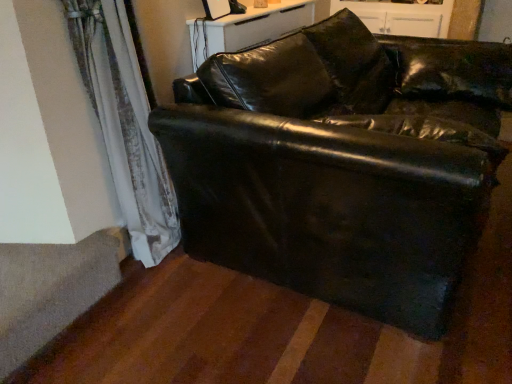
Identify the location of white glossy dresser at upper center. (401, 17).

What do you see at coordinates (401, 17) in the screenshot? I see `white glossy dresser at upper center` at bounding box center [401, 17].

The height and width of the screenshot is (384, 512). What do you see at coordinates (341, 164) in the screenshot? I see `black leather couch at center` at bounding box center [341, 164].

Find the location of a particular element. Image resolution: width=512 pixels, height=384 pixels. satin white curtain at lower left is located at coordinates (125, 124).

In the image, is gray carpet at lower left positioned in front of or behind white glossy dresser at upper center?

gray carpet at lower left is positioned closer to the viewer than white glossy dresser at upper center.

Can you tell me how much gray carpet at lower left and white glossy dresser at upper center differ in facing direction?

gray carpet at lower left and white glossy dresser at upper center are facing 88.9 degrees away from each other.

Looking at their sizes, would you say gray carpet at lower left is wider or thinner than white glossy dresser at upper center?

Considering their sizes, gray carpet at lower left looks slimmer than white glossy dresser at upper center.

From the image's perspective, is gray carpet at lower left on top of white glossy dresser at upper center?

Incorrect, from the image's perspective, gray carpet at lower left is lower than white glossy dresser at upper center.

Is gray carpet at lower left at the back of white glossy dresser at upper center?

white glossy dresser at upper center is not turned away from gray carpet at lower left.

Considering the relative sizes of white glossy dresser at upper center and gray carpet at lower left in the image provided, is white glossy dresser at upper center wider than gray carpet at lower left?

Correct, the width of white glossy dresser at upper center exceeds that of gray carpet at lower left.

Is white glossy dresser at upper center not near gray carpet at lower left?

Absolutely, white glossy dresser at upper center is distant from gray carpet at lower left.

Is gray carpet at lower left located within white glossy dresser at upper center?

No, gray carpet at lower left is not inside white glossy dresser at upper center.

In the scene shown: Does black leather couch at center lie behind white glossy dresser at upper center?

No, black leather couch at center is in front of white glossy dresser at upper center.

Does black leather couch at center have a smaller size compared to white glossy dresser at upper center?

No.

Find the location of a particular element. This screenshot has width=512, height=384. studio couch in front of the white glossy dresser at upper center is located at coordinates (341, 164).

Considering the relative sizes of black leather couch at center and white glossy dresser at upper center in the image provided, is black leather couch at center shorter than white glossy dresser at upper center?

No, black leather couch at center is not shorter than white glossy dresser at upper center.

Is black leather couch at center in contact with satin white curtain at lower left?

No, black leather couch at center is not next to satin white curtain at lower left.

Is black leather couch at center situated inside satin white curtain at lower left or outside?

black leather couch at center lies outside satin white curtain at lower left.

Is black leather couch at center positioned with its back to satin white curtain at lower left?

Yes, satin white curtain at lower left is at the back of black leather couch at center.

Is black leather couch at center in front of satin white curtain at lower left?

Yes.

Can you tell me how much white glossy dresser at upper center and satin white curtain at lower left differ in facing direction?

They differ by 88.9 degrees in their facing directions.

Is white glossy dresser at upper center facing away from satin white curtain at lower left?

No, satin white curtain at lower left is not at the back of white glossy dresser at upper center.

Is white glossy dresser at upper center to the left of satin white curtain at lower left from the viewer's perspective?

No.

Measure the distance between satin white curtain at lower left and black leather couch at center.

satin white curtain at lower left and black leather couch at center are 25.79 inches apart from each other.

Who is taller, satin white curtain at lower left or black leather couch at center?

satin white curtain at lower left.

From a real-world perspective, is satin white curtain at lower left located beneath black leather couch at center?

No, from a real-world perspective, satin white curtain at lower left is not under black leather couch at center.

In terms of size, does satin white curtain at lower left appear bigger or smaller than black leather couch at center?

Clearly, satin white curtain at lower left is smaller in size than black leather couch at center.

Do you think satin white curtain at lower left is within white glossy dresser at upper center, or outside of it?

satin white curtain at lower left lies outside white glossy dresser at upper center.

Considering the sizes of objects satin white curtain at lower left and white glossy dresser at upper center in the image provided, who is shorter, satin white curtain at lower left or white glossy dresser at upper center?

white glossy dresser at upper center.

From a real-world perspective, is satin white curtain at lower left physically located above or below white glossy dresser at upper center?

satin white curtain at lower left is below white glossy dresser at upper center.

From the image's perspective, is satin white curtain at lower left positioned above or below white glossy dresser at upper center?

satin white curtain at lower left is situated lower than white glossy dresser at upper center in the image.

Find the location of a particular element. The height and width of the screenshot is (384, 512). stairwell below the white glossy dresser at upper center (from the image's perspective) is located at coordinates (52, 289).

You are a GUI agent. You are given a task and a screenshot of the screen. Output one action in this format:
    pyautogui.click(x=<x>, y=<y>)
    Task: Click on the stairwell that appears below the white glossy dresser at upper center (from a real-world perspective)
    
    Given the screenshot: What is the action you would take?
    pyautogui.click(x=52, y=289)

From the image, which object appears to be nearer to black leather couch at center, satin white curtain at lower left or white glossy dresser at upper center?

satin white curtain at lower left is closer to black leather couch at center.

Which object lies nearer to the anchor point white glossy dresser at upper center, gray carpet at lower left or satin white curtain at lower left?

The object closer to white glossy dresser at upper center is satin white curtain at lower left.

Which object lies further to the anchor point gray carpet at lower left, white glossy dresser at upper center or satin white curtain at lower left?

The object further to gray carpet at lower left is white glossy dresser at upper center.

From the image, which object appears to be farther from gray carpet at lower left, white glossy dresser at upper center or black leather couch at center?

white glossy dresser at upper center lies further to gray carpet at lower left than the other object.

Considering their positions, is satin white curtain at lower left positioned further to gray carpet at lower left than white glossy dresser at upper center?

Based on the image, white glossy dresser at upper center appears to be further to gray carpet at lower left.

Based on their spatial positions, is white glossy dresser at upper center or black leather couch at center closer to satin white curtain at lower left?

black leather couch at center is closer to satin white curtain at lower left.

Based on their spatial positions, is satin white curtain at lower left or gray carpet at lower left further from black leather couch at center?

gray carpet at lower left lies further to black leather couch at center than the other object.

From the image, which object appears to be nearer to gray carpet at lower left, satin white curtain at lower left or black leather couch at center?

satin white curtain at lower left is positioned closer to the anchor gray carpet at lower left.

The image size is (512, 384). Identify the location of curtain located between black leather couch at center and white glossy dresser at upper center in the depth direction. (125, 124).

You are a GUI agent. You are given a task and a screenshot of the screen. Output one action in this format:
    pyautogui.click(x=<x>, y=<y>)
    Task: Click on the curtain between gray carpet at lower left and black leather couch at center from left to right
    The image size is (512, 384).
    Given the screenshot: What is the action you would take?
    pos(125,124)

Where is `stairwell between satin white curtain at lower left and white glossy dresser at upper center along the z-axis`? This screenshot has width=512, height=384. stairwell between satin white curtain at lower left and white glossy dresser at upper center along the z-axis is located at coordinates (52, 289).

Find the location of a particular element. This screenshot has height=384, width=512. stairwell between black leather couch at center and white glossy dresser at upper center from front to back is located at coordinates point(52,289).